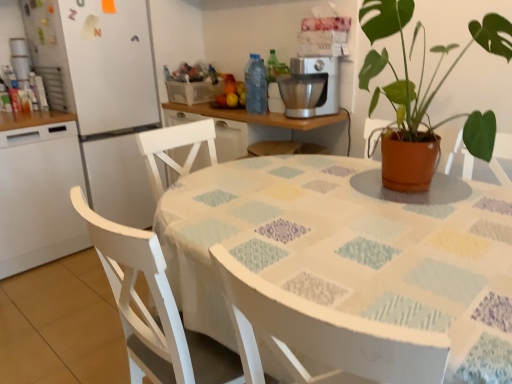
Where is `free space in front of terracotta pot at upper right`? The image size is (512, 384). free space in front of terracotta pot at upper right is located at coordinates (438, 218).